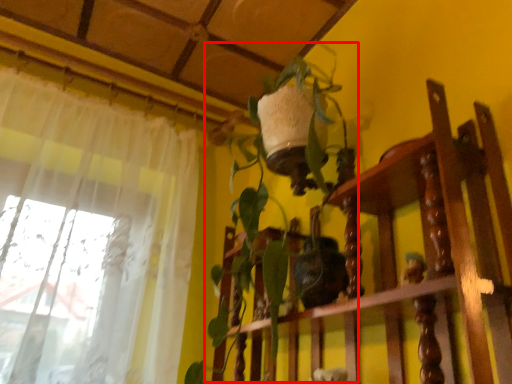
Question: In this image, where is vegetation (annotated by the red box) located relative to furniture?

Choices:
 (A) left
 (B) right

Answer: (A)